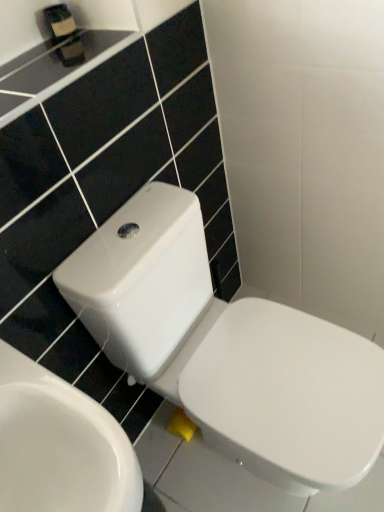
Question: Is point (56, 14) positioned closer to the camera than point (21, 446)?

Choices:
 (A) farther
 (B) closer

Answer: (A)

Question: Is matte black soap dispenser at upper left spatially inside white glossy toilet at lower right, positioned as the second toilet in right-to-left order, or outside of it?

Choices:
 (A) outside
 (B) inside

Answer: (A)

Question: Based on their relative distances, which object is nearer to the matte black soap dispenser at upper left?

Choices:
 (A) white glossy toilet at lower right, placed as the 1th toilet when sorted from left to right
 (B) white glossy toilet at center, placed as the first toilet when sorted from right to left

Answer: (B)

Question: Estimate the real-world distances between objects in this image. Which object is farther from the white glossy toilet at center, placed as the first toilet when sorted from right to left?

Choices:
 (A) matte black soap dispenser at upper left
 (B) white glossy toilet at lower right, placed as the 1th toilet when sorted from left to right

Answer: (A)